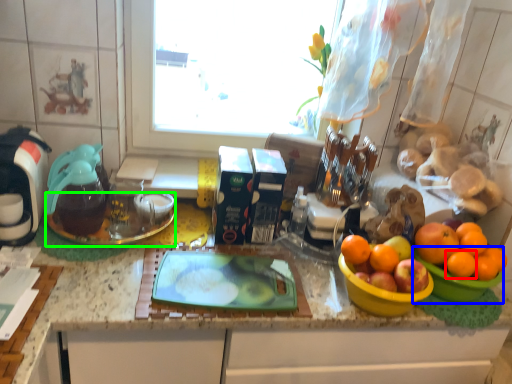
Question: Which object is positioned farthest from orange (highlighted by a red box)? Select from basin (highlighted by a blue box) and glass plate (highlighted by a green box).

Choices:
 (A) basin
 (B) glass plate

Answer: (B)